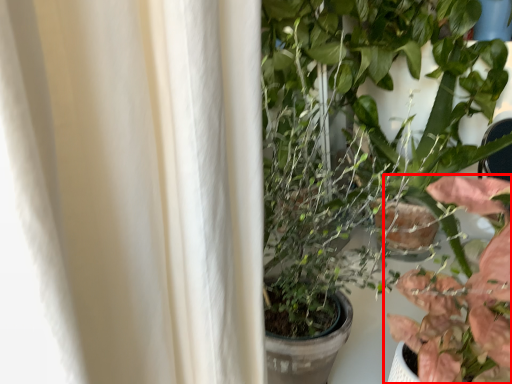
Question: From the image's perspective, where is houseplant (annotated by the red box) located in relation to houseplant in the image?

Choices:
 (A) above
 (B) below

Answer: (B)